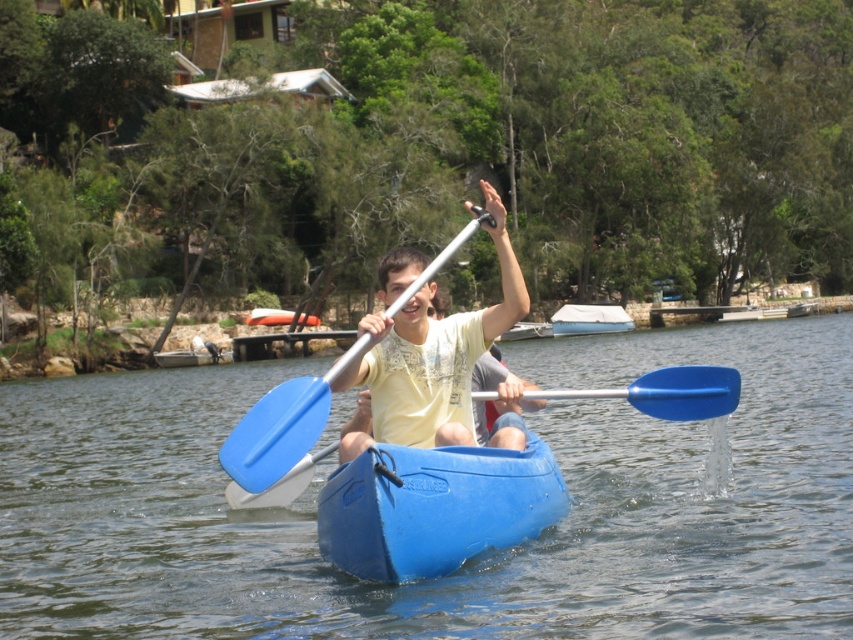
You are planning to store both the blue plastic canoe at center and the white canvas boat at center in a storage room that is 1 meter wide. Based on their widths, can both fit side by side?

The blue plastic canoe at center is thinner than the white canvas boat at center. However, without knowing the exact widths of both objects, it is impossible to determine if their combined width is less than or equal to 1 meter. Additional measurements are needed to confirm.